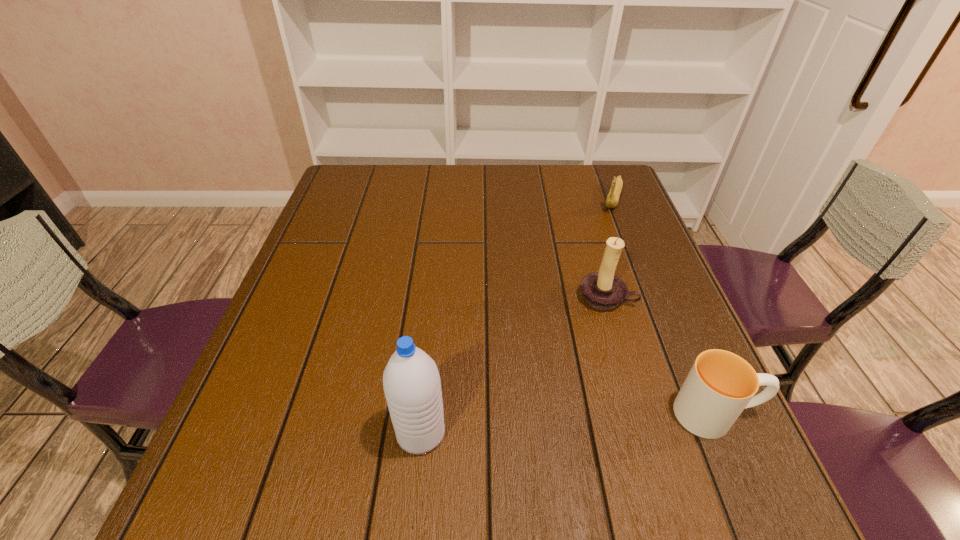
Identify the location of free space that satisfies the following two spatial constraints: 1. on the front side of the cup; 2. with the handle on the side of the candle holder. Image resolution: width=960 pixels, height=540 pixels. (640, 414).